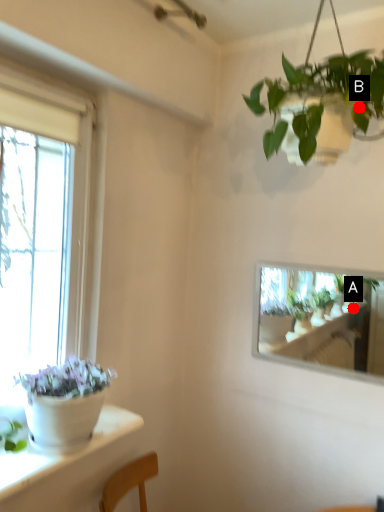
Question: Two points are circled on the image, labeled by A and B beside each circle. Which point is closer to the camera taking this photo?

Choices:
 (A) A is closer
 (B) B is closer

Answer: (B)